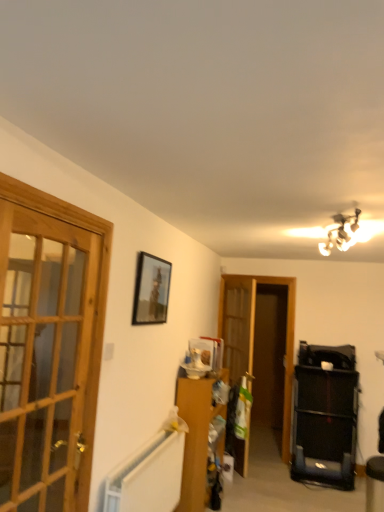
Question: Would you say wooden cabinet at center is inside or outside metallic chandelier at upper right?

Choices:
 (A) outside
 (B) inside

Answer: (A)

Question: Considering their positions, is wooden cabinet at center located in front of or behind metallic chandelier at upper right?

Choices:
 (A) front
 (B) behind

Answer: (B)

Question: Which object is the farthest from the wooden glass door at left?

Choices:
 (A) metallic chandelier at upper right
 (B) translucent wood screen door at center
 (C) wooden cabinet at center
 (D) matte black picture frame at upper center

Answer: (A)

Question: Which object is positioned closest to the wooden glass door at left?

Choices:
 (A) metallic chandelier at upper right
 (B) matte black picture frame at upper center
 (C) translucent wood screen door at center
 (D) wooden cabinet at center

Answer: (B)